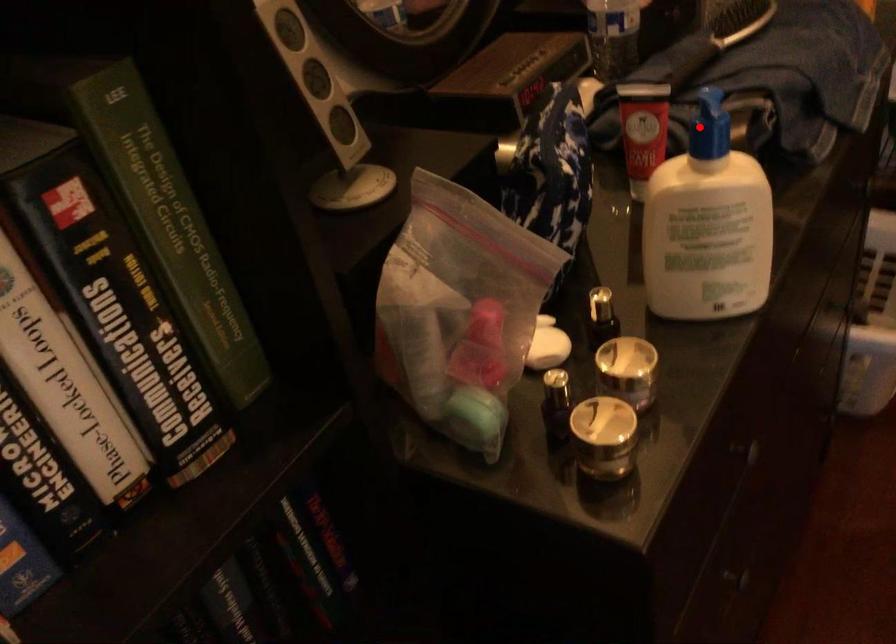
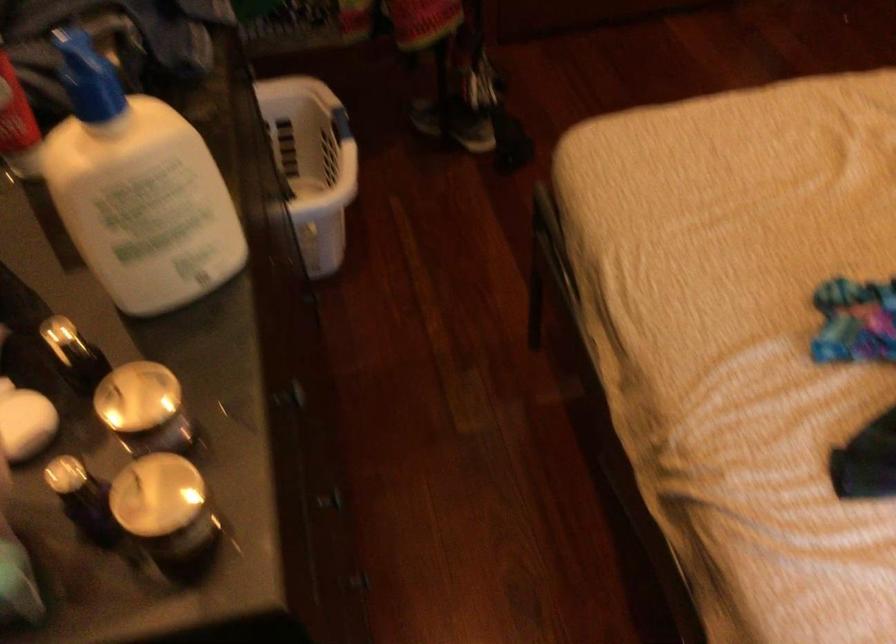
In the second image, find the point that corresponds to the highlighted location in the first image.

(88, 77)